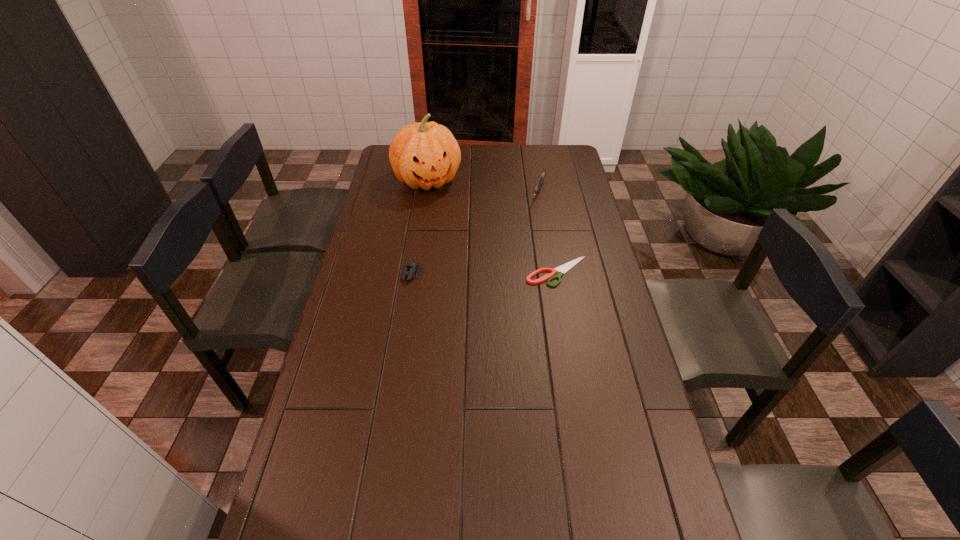
Locate an element on the screen. The image size is (960, 540). computer mouse is located at coordinates (411, 269).

Image resolution: width=960 pixels, height=540 pixels. What are the coordinates of `the shortest object` in the screenshot? It's located at click(562, 269).

Image resolution: width=960 pixels, height=540 pixels. Identify the location of pumpkin. (423, 155).

At what (x,y) coordinates should I click in order to perform the action: click on gun. Please return your answer as a coordinate pair (x, y). The image size is (960, 540). Looking at the image, I should click on tap(541, 179).

The height and width of the screenshot is (540, 960). In order to click on free spot located on the back of the second shortest object in this screenshot , I will do tap(422, 202).

Locate an element on the screen. The width and height of the screenshot is (960, 540). vacant space located on the front of the shortest object is located at coordinates (566, 323).

In order to click on free space located on the carved face of the pumpkin in this screenshot , I will do `click(439, 206)`.

The height and width of the screenshot is (540, 960). In order to click on vacant space situated 0.230m on the carved face of the pumpkin in this screenshot , I will do `click(450, 232)`.

Locate an element on the screen. The height and width of the screenshot is (540, 960). vacant area situated 0.160m on the carved face of the pumpkin is located at coordinates (445, 221).

Image resolution: width=960 pixels, height=540 pixels. Identify the location of free point located aimed along the barrel of the second tallest object. (535, 215).